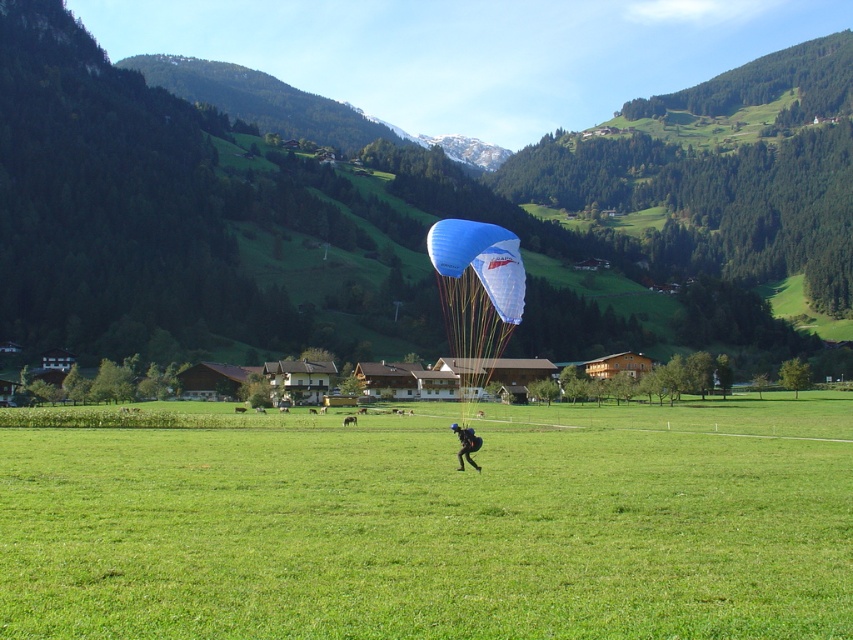
Question: Is green forested mountain at upper center further to camera compared to matte black parachute at center?

Choices:
 (A) yes
 (B) no

Answer: (A)

Question: Does green grass field at center appear over matte black parachute at center?

Choices:
 (A) no
 (B) yes

Answer: (A)

Question: Is blue fabric parachute at center above matte black parachute at center?

Choices:
 (A) yes
 (B) no

Answer: (A)

Question: Among these points, which one is farthest from the camera?

Choices:
 (A) (461, 436)
 (B) (334, 432)
 (C) (444, 237)

Answer: (B)

Question: Which object appears farthest from the camera in this image?

Choices:
 (A) green grass field at center
 (B) blue fabric parachute at center

Answer: (B)

Question: Which is farther from the green grass field at center?

Choices:
 (A) matte black parachute at center
 (B) blue fabric parachute at center
 (C) green forested mountain at upper center

Answer: (C)